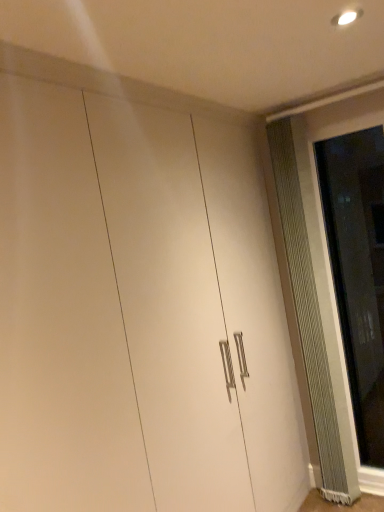
Question: Can you confirm if clear glass screen door at right is smaller than metallic ribbed radiator at right?

Choices:
 (A) yes
 (B) no

Answer: (A)

Question: Does clear glass screen door at right turn towards metallic ribbed radiator at right?

Choices:
 (A) yes
 (B) no

Answer: (B)

Question: From a real-world perspective, is clear glass screen door at right located higher than metallic ribbed radiator at right?

Choices:
 (A) no
 (B) yes

Answer: (A)

Question: Does clear glass screen door at right appear on the right side of metallic ribbed radiator at right?

Choices:
 (A) yes
 (B) no

Answer: (A)

Question: Is clear glass screen door at right not inside metallic ribbed radiator at right?

Choices:
 (A) yes
 (B) no

Answer: (A)

Question: Is metallic ribbed radiator at right inside clear glass screen door at right?

Choices:
 (A) yes
 (B) no

Answer: (B)

Question: Is metallic ribbed radiator at right positioned far away from clear glass screen door at right?

Choices:
 (A) no
 (B) yes

Answer: (A)

Question: Is metallic ribbed radiator at right at the right side of clear glass screen door at right?

Choices:
 (A) yes
 (B) no

Answer: (B)

Question: Can you confirm if metallic ribbed radiator at right is taller than clear glass screen door at right?

Choices:
 (A) yes
 (B) no

Answer: (A)

Question: Is metallic ribbed radiator at right oriented towards clear glass screen door at right?

Choices:
 (A) no
 (B) yes

Answer: (A)

Question: Is metallic ribbed radiator at right directly adjacent to clear glass screen door at right?

Choices:
 (A) yes
 (B) no

Answer: (B)

Question: Considering the relative sizes of metallic ribbed radiator at right and clear glass screen door at right in the image provided, is metallic ribbed radiator at right bigger than clear glass screen door at right?

Choices:
 (A) yes
 (B) no

Answer: (A)

Question: From the image's perspective, relative to metallic ribbed radiator at right, is clear glass screen door at right above or below?

Choices:
 (A) below
 (B) above

Answer: (B)